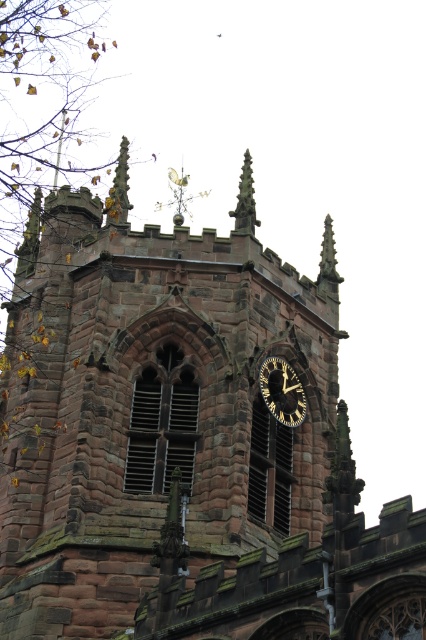
Question: Does gold/black clock at center have a larger size compared to smooth stone spire at upper center?

Choices:
 (A) no
 (B) yes

Answer: (A)

Question: Which point is closer to the camera taking this photo?

Choices:
 (A) (249, 232)
 (B) (270, 401)

Answer: (B)

Question: Which point appears closest to the camera in this image?

Choices:
 (A) (244, 176)
 (B) (268, 406)

Answer: (B)

Question: Is gold/black clock at center above smooth stone spire at upper center?

Choices:
 (A) no
 (B) yes

Answer: (A)

Question: Does gold/black clock at center appear under smooth stone spire at upper center?

Choices:
 (A) yes
 (B) no

Answer: (A)